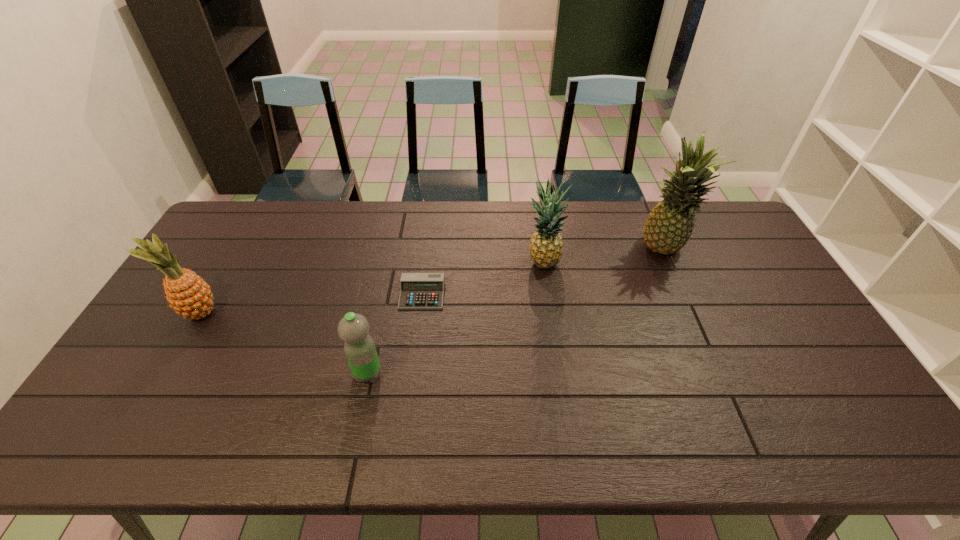
Where is `free space between the second pineapple from left to right and the rightmost object`? free space between the second pineapple from left to right and the rightmost object is located at coordinates (603, 257).

Find the location of a particular element. The width and height of the screenshot is (960, 540). vacant space in between the third object from left to right and the fourth tallest object is located at coordinates (395, 334).

This screenshot has height=540, width=960. Find the location of `object that is the third closest to the nearest pineapple`. object that is the third closest to the nearest pineapple is located at coordinates (546, 245).

Locate an element on the screen. object that stands as the fourth closest to the second pineapple from left to right is located at coordinates (190, 296).

The height and width of the screenshot is (540, 960). I want to click on pineapple object that ranks as the second closest to the leftmost object, so click(669, 226).

Image resolution: width=960 pixels, height=540 pixels. I want to click on pineapple identified as the closest to the second object from right to left, so click(x=669, y=226).

Locate an element on the screen. This screenshot has height=540, width=960. free region that satisfies the following two spatial constraints: 1. on the back side of the fourth tallest object; 2. on the left side of the rightmost pineapple is located at coordinates (394, 250).

I want to click on vacant point that satisfies the following two spatial constraints: 1. on the back side of the calculator; 2. on the right side of the rightmost pineapple, so click(x=428, y=250).